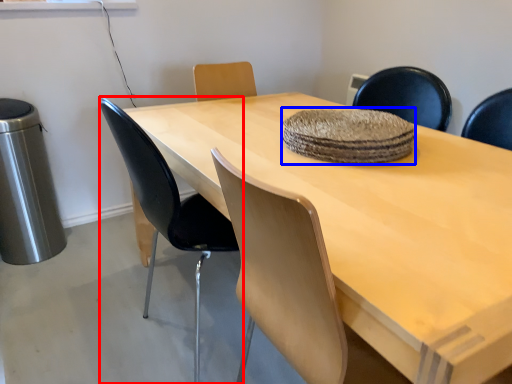
Question: Among these objects, which one is farthest to the camera, chair (highlighted by a red box) or mat (highlighted by a blue box)?

Choices:
 (A) chair
 (B) mat

Answer: (B)